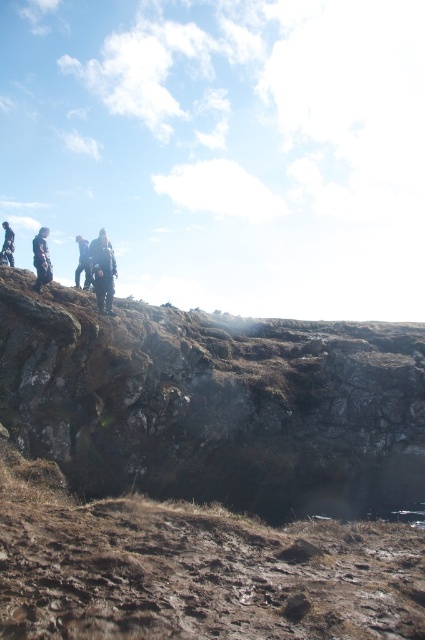
Question: Can you confirm if dark blue jacket at upper center is positioned below dark gray clothing at left?

Choices:
 (A) no
 (B) yes

Answer: (B)

Question: Which of these objects is positioned farthest from the dark blue jacket at upper center?

Choices:
 (A) dark gray clothing at left
 (B) rough textured rock at center

Answer: (B)

Question: Considering the relative positions of dark blue jacket at upper center and dark gray clothing at left in the image provided, where is dark blue jacket at upper center located with respect to dark gray clothing at left?

Choices:
 (A) below
 (B) above

Answer: (A)

Question: Does rough textured rock at center appear under dark gray clothing at left?

Choices:
 (A) no
 (B) yes

Answer: (B)

Question: Among these objects, which one is nearest to the camera?

Choices:
 (A) dark gray clothing at left
 (B) rough textured rock at center
 (C) dark blue jacket at upper center

Answer: (B)

Question: Which is nearer to the dark gray clothing at left?

Choices:
 (A) rough textured rock at center
 (B) dark blue jacket at upper center

Answer: (B)